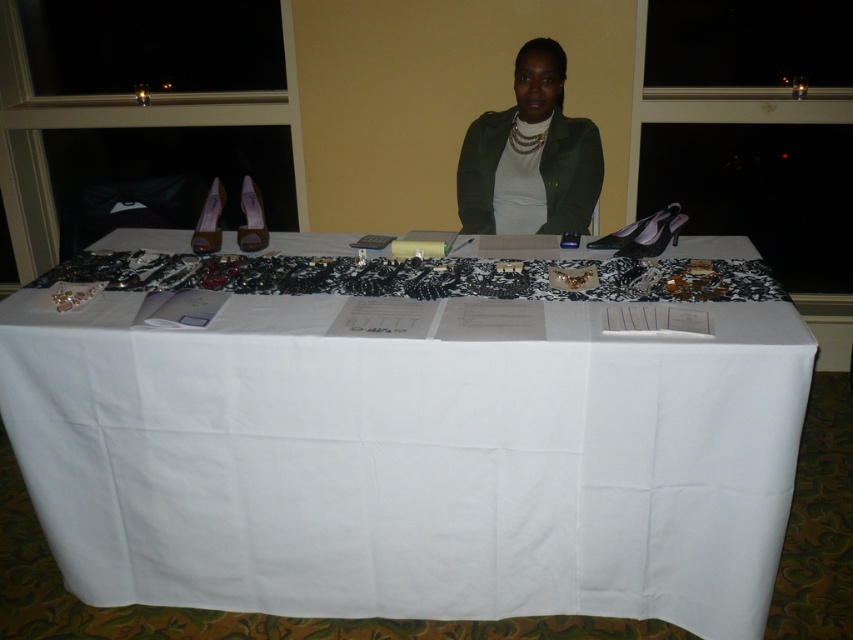
You are standing in the room where the white fabric table at center is placed. If you face the table, which direction would the large windows be relative to the table?

The large windows are behind the white fabric table at center since the table is positioned against the wall with large windows.

You are a guest at an event and see the white fabric table at center and the green matte jacket at center. Which object is closer to the floor?

The white fabric table at center is closer to the floor because it is located below the green matte jacket at center.